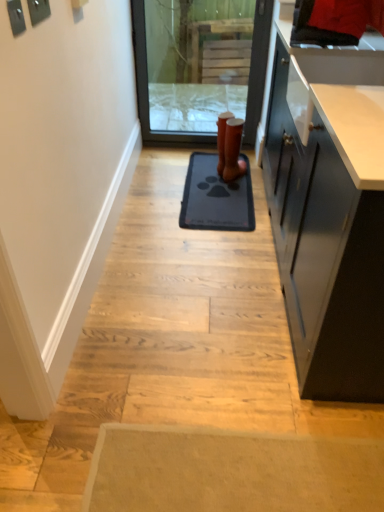
The width and height of the screenshot is (384, 512). Describe the element at coordinates (216, 197) in the screenshot. I see `gray rubber mat at center` at that location.

Describe the element at coordinates (147, 82) in the screenshot. This screenshot has width=384, height=512. I see `transparent glass screen door at center` at that location.

Identify the location of gray rubber mat at center. (216, 197).

Considering the positions of objects brown leather boot at center and gray rubber mat at center in the image provided, who is behind, brown leather boot at center or gray rubber mat at center?

brown leather boot at center is further away from the camera.

From a real-world perspective, which object stands above the other?

brown leather boot at center.

Could you tell me if brown leather boot at center is facing gray rubber mat at center?

Yes.

Considering the sizes of objects brown leather boot at center and gray rubber mat at center in the image provided, who is wider, brown leather boot at center or gray rubber mat at center?

gray rubber mat at center.

From the picture: Is gray rubber mat at center turned away from transparent glass screen door at center?

gray rubber mat at center does not have its back to transparent glass screen door at center.

Can you confirm if gray rubber mat at center is bigger than transparent glass screen door at center?

No, gray rubber mat at center is not bigger than transparent glass screen door at center.

Considering the sizes of objects gray rubber mat at center and transparent glass screen door at center in the image provided, who is wider, gray rubber mat at center or transparent glass screen door at center?

gray rubber mat at center.

Considering the positions of objects gray rubber mat at center and transparent glass screen door at center in the image provided, who is more to the right, gray rubber mat at center or transparent glass screen door at center?

gray rubber mat at center is more to the right.

Consider the image. Is gray rubber mat at center next to brown leather boot at center?

gray rubber mat at center and brown leather boot at center are clearly separated.

Could you tell me if gray rubber mat at center is facing brown leather boot at center?

No, gray rubber mat at center is not aimed at brown leather boot at center.

From the picture: From the image's perspective, is gray rubber mat at center below brown leather boot at center?

Correct, gray rubber mat at center appears lower than brown leather boot at center in the image.

Could brown leather boot at center be considered to be inside gray rubber mat at center?

No, brown leather boot at center is not surrounded by gray rubber mat at center.

Which is less distant, (232, 129) or (144, 112)?

The point (232, 129) is in front.

From a real-world perspective, is brown leather boot at center on transparent glass screen door at center?

Actually, brown leather boot at center is physically below transparent glass screen door at center in the real world.

The width and height of the screenshot is (384, 512). Find the location of `screen door above the brown leather boot at center (from the image's perspective)`. screen door above the brown leather boot at center (from the image's perspective) is located at coordinates (147, 82).

Is brown leather boot at center taller or shorter than transparent glass screen door at center?

Clearly, brown leather boot at center is shorter compared to transparent glass screen door at center.

From a real-world perspective, which is physically above, transparent glass screen door at center or gray rubber mat at center?

From a 3D spatial view, transparent glass screen door at center is above.

Does transparent glass screen door at center come in front of gray rubber mat at center?

No, it is behind gray rubber mat at center.

Considering the sizes of objects transparent glass screen door at center and gray rubber mat at center in the image provided, who is wider, transparent glass screen door at center or gray rubber mat at center?

gray rubber mat at center is wider.

Considering the relative positions of transparent glass screen door at center and gray rubber mat at center in the image provided, is transparent glass screen door at center to the left of gray rubber mat at center from the viewer's perspective?

Yes.

From a real-world perspective, is transparent glass screen door at center on brown leather boot at center?

Correct, in the physical world, transparent glass screen door at center is higher than brown leather boot at center.

Can you confirm if transparent glass screen door at center is positioned to the right of brown leather boot at center?

Incorrect, transparent glass screen door at center is not on the right side of brown leather boot at center.

Locate an element on the screen. Image resolution: width=384 pixels, height=512 pixels. footwear located below the transparent glass screen door at center (from the image's perspective) is located at coordinates (233, 150).

Looking at their sizes, would you say transparent glass screen door at center is wider or thinner than brown leather boot at center?

transparent glass screen door at center is thinner than brown leather boot at center.

I want to click on footwear behind the gray rubber mat at center, so click(233, 150).

At what (x,y) coordinates should I click in order to perform the action: click on screen door above the gray rubber mat at center (from a real-world perspective). Please return your answer as a coordinate pair (x, y). The image size is (384, 512). Looking at the image, I should click on (147, 82).

Looking at the image, which one is located closer to gray rubber mat at center, brown leather boot at center or transparent glass screen door at center?

The object closer to gray rubber mat at center is brown leather boot at center.

Estimate the real-world distances between objects in this image. Which object is closer to transparent glass screen door at center, gray rubber mat at center or brown leather boot at center?

brown leather boot at center is closer to transparent glass screen door at center.

Estimate the real-world distances between objects in this image. Which object is further from brown leather boot at center, transparent glass screen door at center or gray rubber mat at center?

transparent glass screen door at center lies further to brown leather boot at center than the other object.

From the image, which object appears to be farther from brown leather boot at center, gray rubber mat at center or transparent glass screen door at center?

transparent glass screen door at center.

Considering their positions, is transparent glass screen door at center positioned further to gray rubber mat at center than brown leather boot at center?

transparent glass screen door at center is positioned further to the anchor gray rubber mat at center.

In the scene shown: From the image, which object appears to be farther from transparent glass screen door at center, brown leather boot at center or gray rubber mat at center?

Based on the image, gray rubber mat at center appears to be further to transparent glass screen door at center.

At what (x,y) coordinates should I click in order to perform the action: click on footwear between transparent glass screen door at center and gray rubber mat at center vertically. Please return your answer as a coordinate pair (x, y). Looking at the image, I should click on (233, 150).